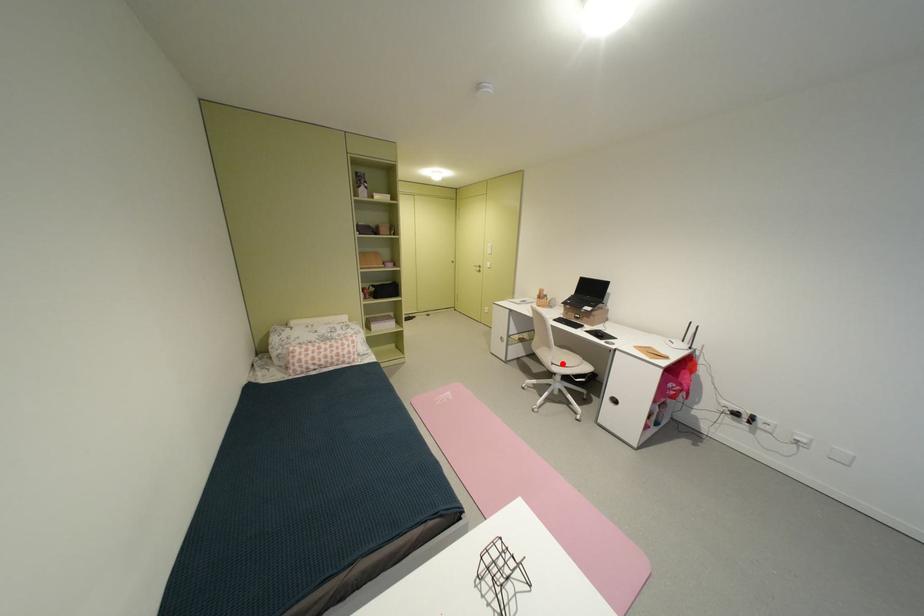
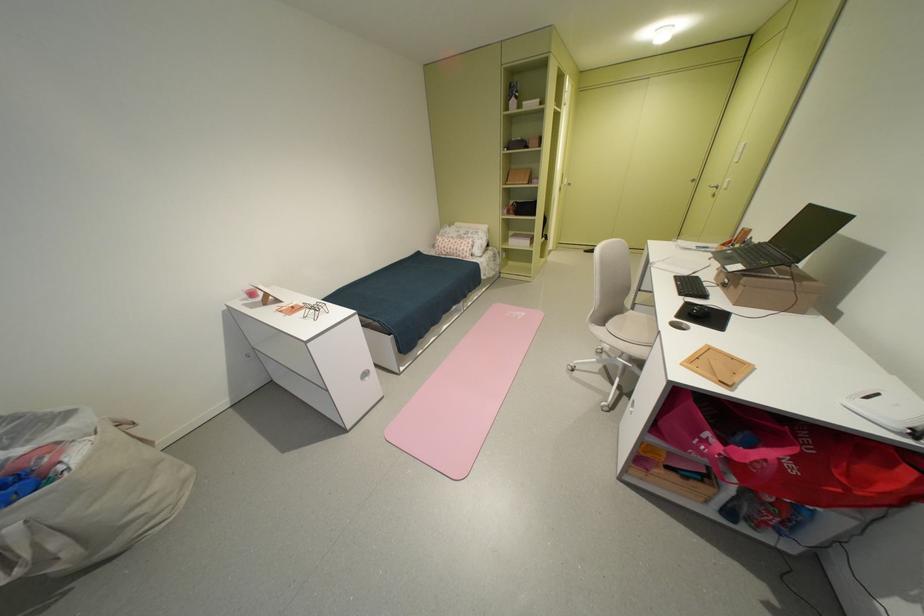
Question: I am providing you with two images of the same scene from different viewpoints. Given a red point in image1, look at the same physical point in image2. Is it:

Choices:
 (A) Closer to the viewpoint
 (B) Farther from the viewpoint

Answer: (B)